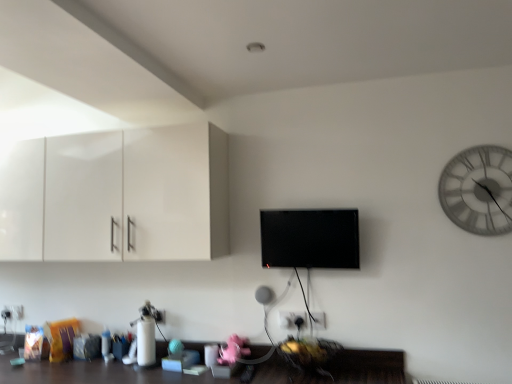
Question: Is white plastic electric outlet at lower center, which is counted as the 1th electric outlet, starting from the front, taller or shorter than black glossy flat screen tv at center?

Choices:
 (A) tall
 (B) short

Answer: (B)

Question: Is point (325, 319) positioned closer to the camera than point (285, 221)?

Choices:
 (A) closer
 (B) farther

Answer: (B)

Question: Estimate the real-world distances between objects in this image. Which object is closer to the white glossy cabinet at upper left?

Choices:
 (A) white glass clock at upper right
 (B) black glossy flat screen tv at center
 (C) white plastic electric outlet at lower center, placed as the second electric outlet when sorted from back to front
 (D) white plastic electric outlet at lower left, placed as the 2th electric outlet when sorted from right to left

Answer: (B)

Question: Which object is the farthest from the white plastic electric outlet at lower center, placed as the second electric outlet when sorted from back to front?

Choices:
 (A) white plastic electric outlet at lower left, which ranks as the first electric outlet in bottom-to-top order
 (B) white glossy cabinet at upper left
 (C) white glass clock at upper right
 (D) black glossy flat screen tv at center

Answer: (A)